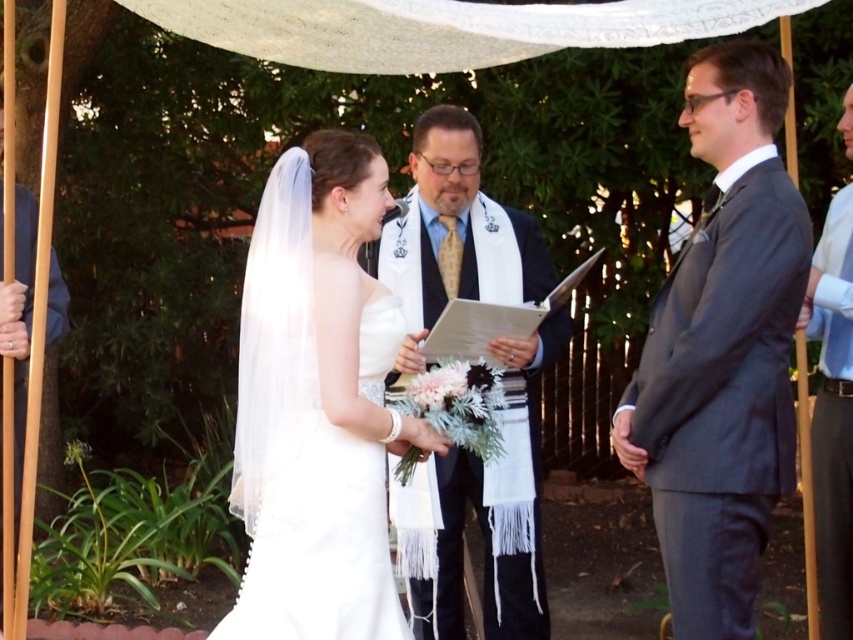
You are a photographer at the wedding ceremony. You need to capture a photo of both the white satin dress at center and the white satin dress at left. Which dress should you focus on first if you want to highlight the smaller one?

The white satin dress at center should be focused on first because it has a smaller size compared to the white satin dress at left.

You are a photographer at the wedding ceremony. You need to capture a closeup shot of the bride and the officiant. The white satin dress at center and the white textured scarf at center are both in the frame. Which one is shorter in height?

The white satin dress at center is shorter than the white textured scarf at center.

You are a photographer at the wedding ceremony. You want to capture a photo of the light blue shirt at right and the white satin dress at left. From the photographer perspective, which one is closer to the camera?

The light blue shirt at right is closer to the camera than the white satin dress at left because the white satin dress at left is behind the light blue shirt at right.